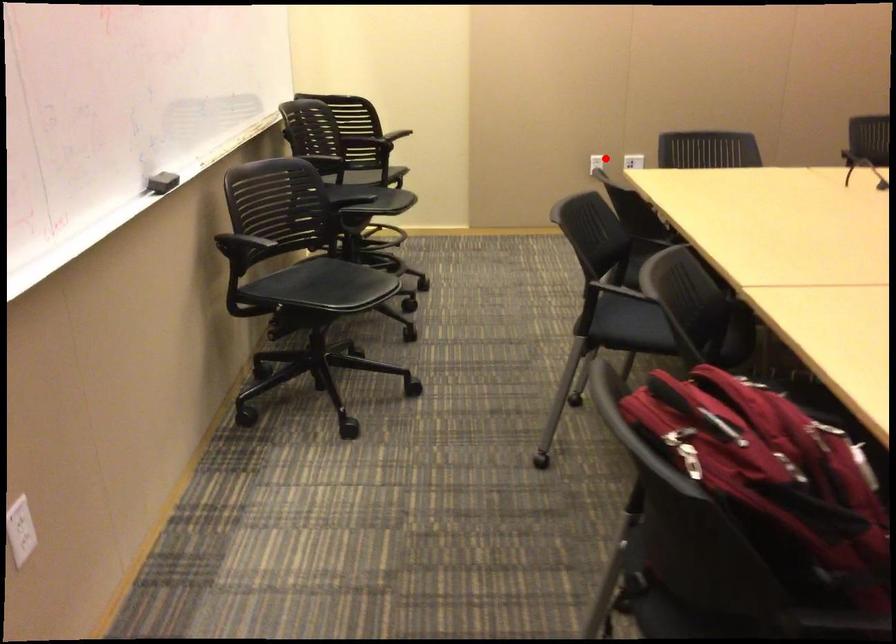
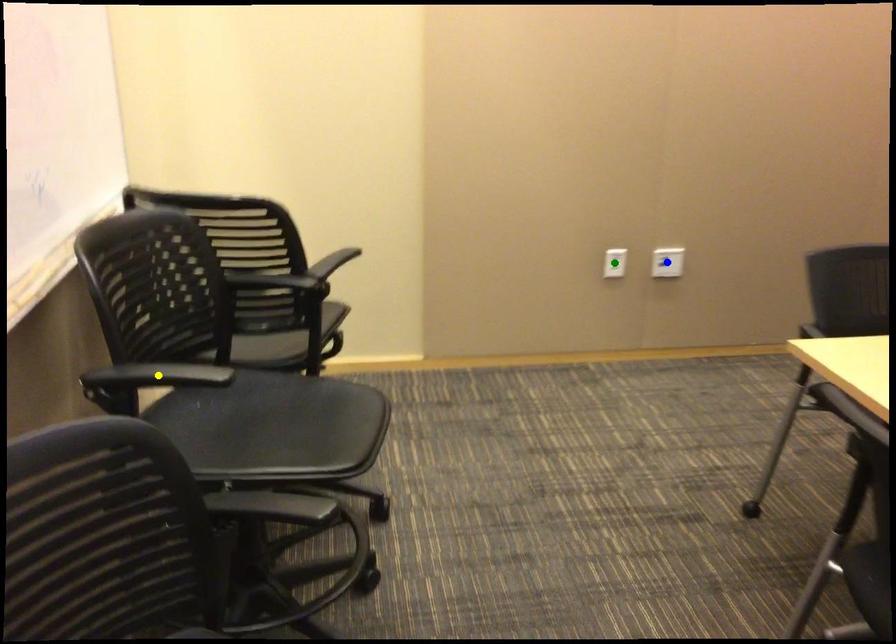
Question: I am providing you with two images of the same scene from different viewpoints. A red point is marked on the first image. You are given multiple points on the second image. Which mark in image 2 goes with the point in image 1?

Choices:
 (A) green point
 (B) blue point
 (C) yellow point

Answer: (A)